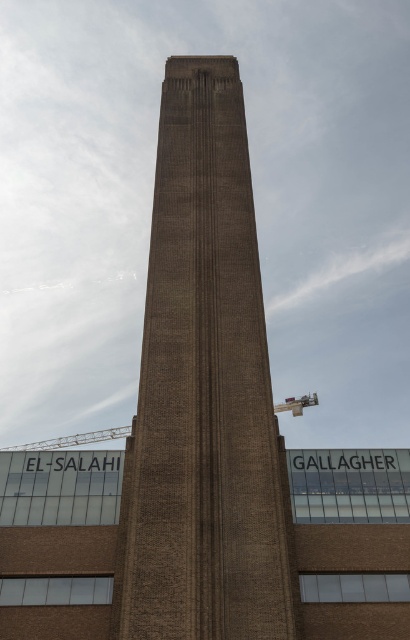
You are standing in front of a construction site. You see a brown brick tower at center and a metallic construction crane at center. Which object is positioned to the right of the other?

The brown brick tower at center is to the right of the metallic construction crane at center.

You are an architect planning to install a new billboard between the brown brick tower at center and the metallic construction crane at center. Given their widths, which object should the billboard be placed closer to to ensure it doesn

The billboard should be placed closer to the metallic construction crane at center because the brown brick tower at center is narrower than the metallic construction crane at center, so the crane has more space available next to it for the billboard.